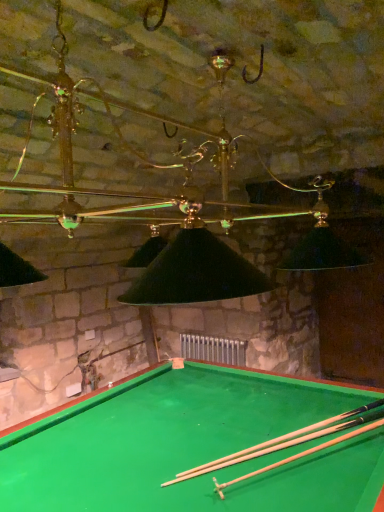
The height and width of the screenshot is (512, 384). Identify the location of vacant region above light brown wood cue at bottom right (from a real-world perspective). (288, 438).